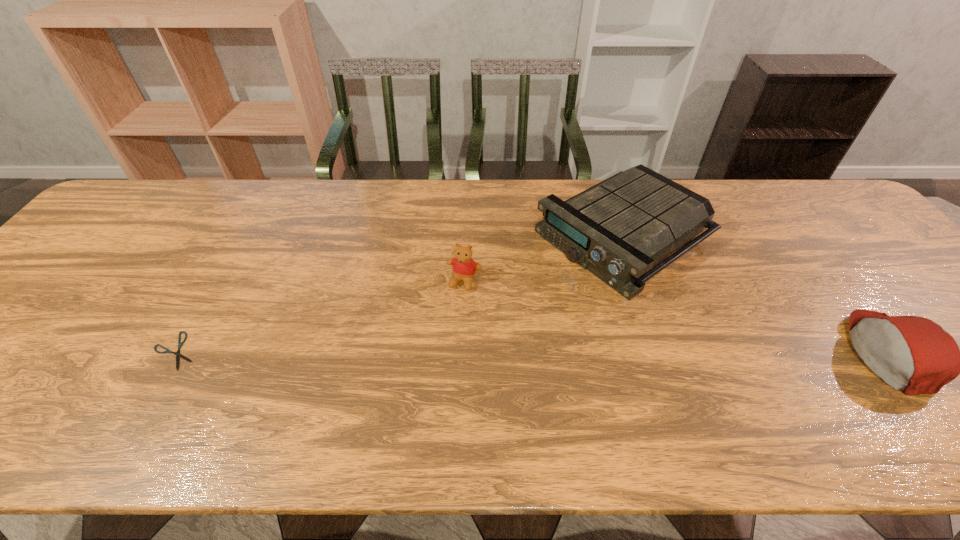
Locate an element on the screen. The image size is (960, 540). vacant region located on the front-facing side of the teddy bear is located at coordinates [x=434, y=361].

Where is `object situated at the far edge`? The width and height of the screenshot is (960, 540). object situated at the far edge is located at coordinates [x=618, y=229].

Find the location of a particular element. The image size is (960, 540). object that is positioned at the near edge is located at coordinates (180, 344).

Image resolution: width=960 pixels, height=540 pixels. In the image, there is a desktop. Find the location of `free region at the far edge`. free region at the far edge is located at coordinates (252, 222).

At what (x,y) coordinates should I click in order to perform the action: click on free space at the near edge. Please return your answer as a coordinate pair (x, y). Looking at the image, I should click on (773, 392).

This screenshot has width=960, height=540. In order to click on vacant space at the left edge of the desktop in this screenshot , I will do `click(27, 319)`.

This screenshot has width=960, height=540. Identify the location of free space at the right edge of the desktop. (860, 281).

You are a GUI agent. You are given a task and a screenshot of the screen. Output one action in this format:
    pyautogui.click(x=<x>, y=<y>)
    Task: Click on the vacant space at the far left corner
    The width and height of the screenshot is (960, 540).
    Given the screenshot: What is the action you would take?
    pyautogui.click(x=146, y=200)

Where is `free point between the teddy bear and the leftmost object`? free point between the teddy bear and the leftmost object is located at coordinates (321, 316).

Locate an element on the screen. free space between the radio receiver and the teddy bear is located at coordinates (544, 258).